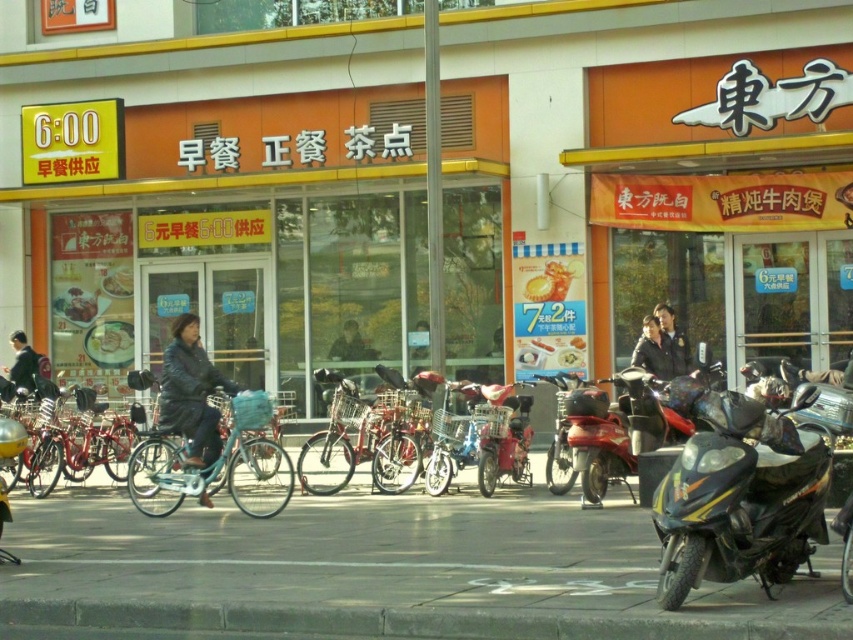
You are standing in front of the commercial building and want to know which of the two points, point (735, 452) or point (334, 412), is closer to you. Can you determine this based on the scene?

Point (735, 452) is closer to the viewer than point (334, 412).

You are standing at the point labeled as point [335,348] and want to walk to the entrance of the commercial building. There is an obstacle at point [695,529]. Can you safely walk around the obstacle to reach the entrance?

The point [695,529] is in front of point [335,348], so the obstacle is blocking your path. You need to find an alternative route to reach the entrance safely.